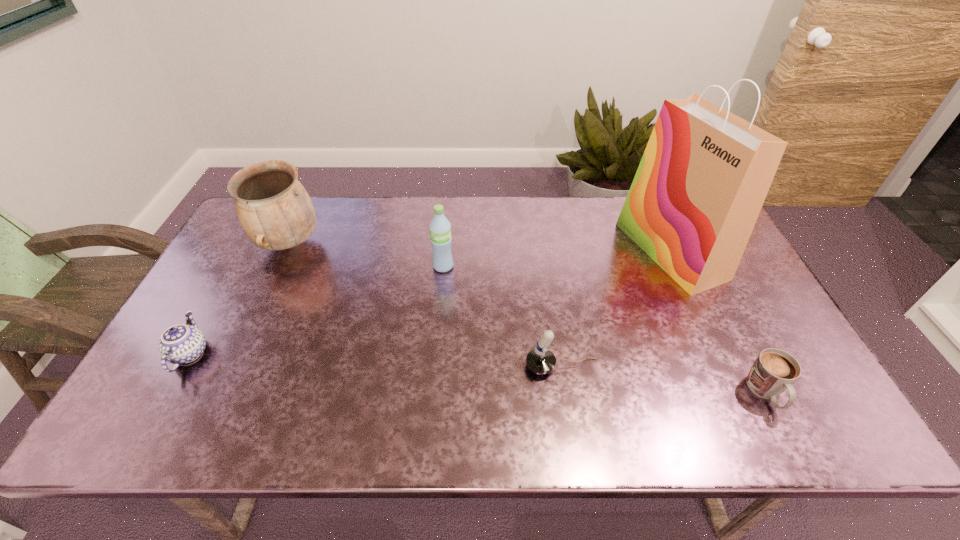
I want to click on shopping bag, so click(x=705, y=173).

Locate an element on the screen. This screenshot has width=960, height=540. urn is located at coordinates (274, 209).

I want to click on water bottle, so click(x=440, y=228).

Where is `microphone`? This screenshot has width=960, height=540. microphone is located at coordinates (540, 360).

The image size is (960, 540). Find the location of `the fourth object from left to right`. the fourth object from left to right is located at coordinates (540, 360).

The image size is (960, 540). I want to click on chinaware, so click(x=180, y=344).

I want to click on mug, so click(x=774, y=371).

Where is `blank area located on the front of the tallest object`? This screenshot has height=540, width=960. blank area located on the front of the tallest object is located at coordinates (718, 354).

Locate an element on the screen. This screenshot has width=960, height=540. free region located on the front of the urn is located at coordinates (224, 384).

You are a GUI agent. You are given a task and a screenshot of the screen. Output one action in this format:
    pyautogui.click(x=<x>, y=<y>)
    Task: Click on the vacant space positioned on the front of the fourth object from right to left
    The height and width of the screenshot is (540, 960).
    Given the screenshot: What is the action you would take?
    pyautogui.click(x=437, y=342)